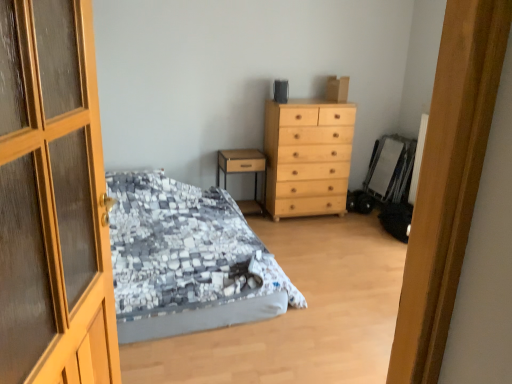
At what (x,y) coordinates should I click in order to perform the action: click on vacant point to the right of textured gray bed at center. Please return your answer as a coordinate pair (x, y). This screenshot has height=384, width=512. Looking at the image, I should click on (336, 271).